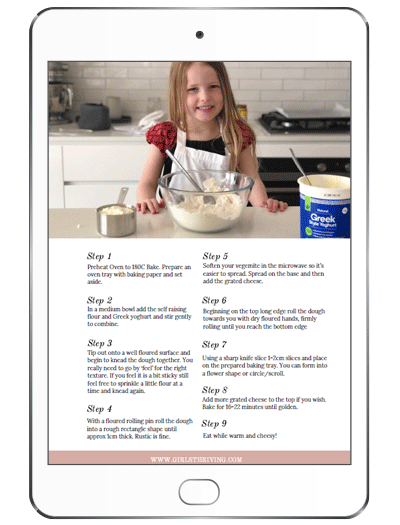
The height and width of the screenshot is (525, 400). In order to click on stove knobs in this screenshot , I will do `click(321, 167)`, `click(347, 169)`.